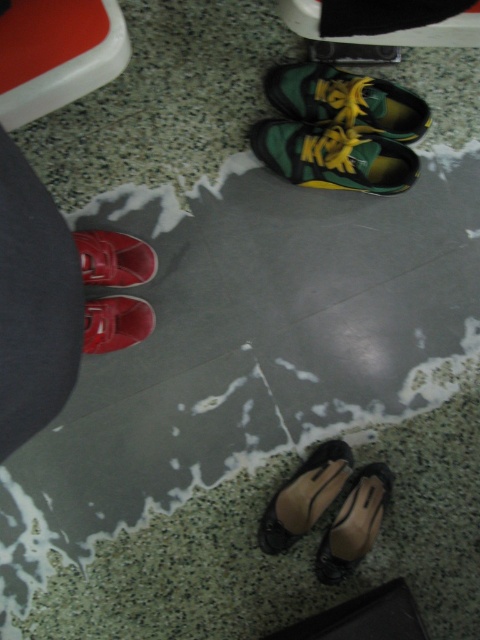
Question: Can you confirm if green matte sneakers at upper center is positioned to the right of shiny black shoe at lower center?

Choices:
 (A) yes
 (B) no

Answer: (B)

Question: Which is nearer to the shiny black shoe at lower center?

Choices:
 (A) shiny black high-heeled shoe at lower center
 (B) shiny red shoe at lower left
 (C) green matte sneakers at upper center
 (D) green matte shoe at upper center

Answer: (A)

Question: Estimate the real-world distances between objects in this image. Which object is farther from the shiny black shoe at lower center?

Choices:
 (A) shiny red shoe at lower left
 (B) green matte sneakers at upper center
 (C) shiny black high-heeled shoe at lower center

Answer: (B)

Question: Is shiny black high-heeled shoe at lower center to the right of shiny black shoe at lower center from the viewer's perspective?

Choices:
 (A) yes
 (B) no

Answer: (B)

Question: Which object is farther from the camera taking this photo?

Choices:
 (A) green matte shoe at upper center
 (B) shiny black high-heeled shoe at lower center

Answer: (B)

Question: Is shiny red shoe at lower left to the left of matte red shoe at lower left from the viewer's perspective?

Choices:
 (A) no
 (B) yes

Answer: (B)